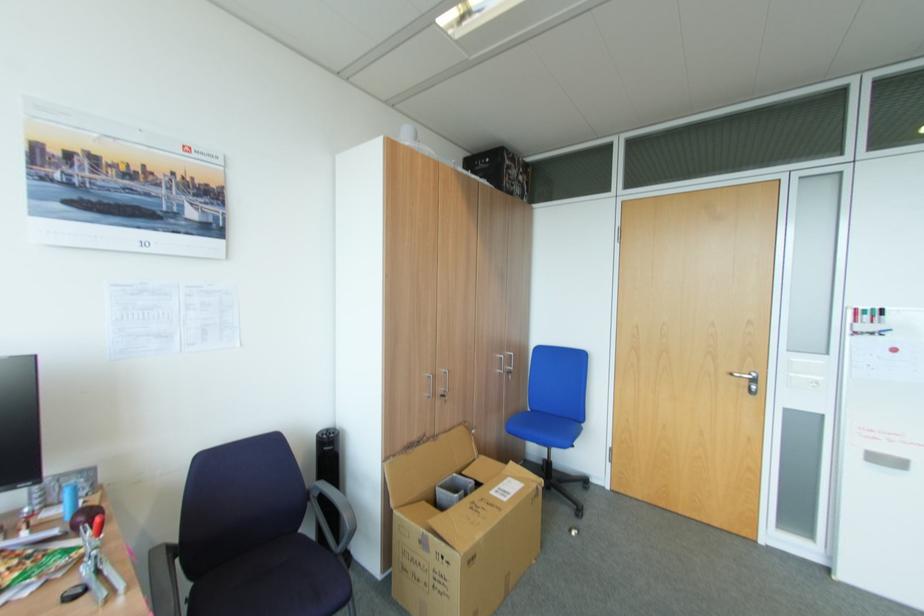
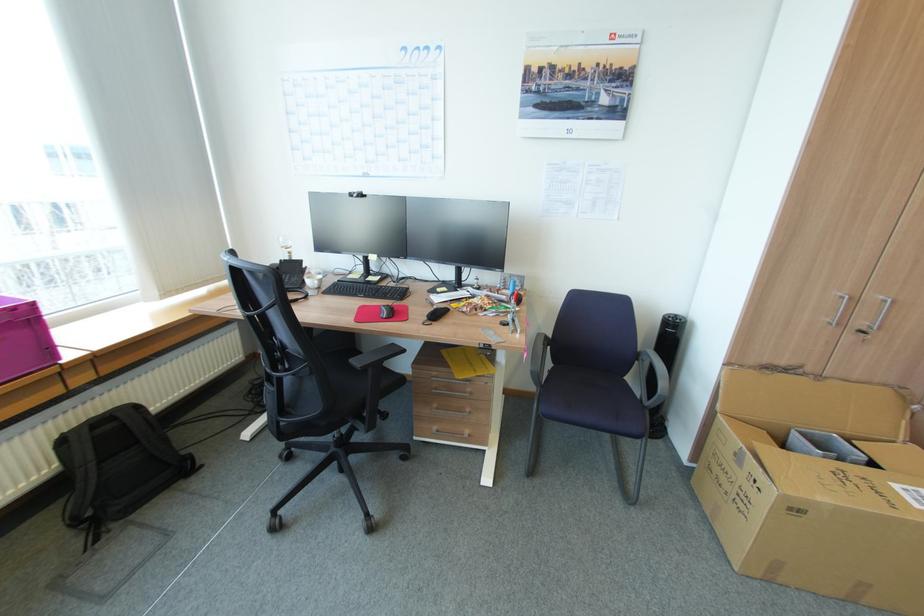
Locate, in the second image, the point that corresponds to point (448, 395) in the first image.

(868, 331)